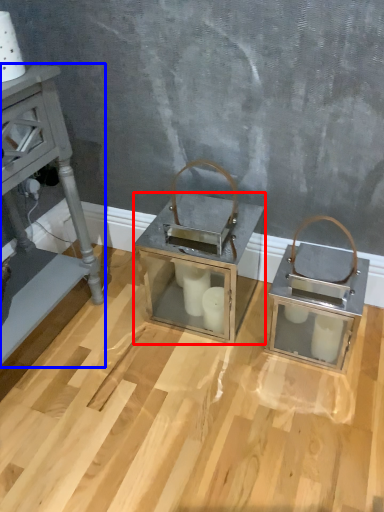
Question: Which of the following is the farthest to the observer, table (highlighted by a red box) or furniture (highlighted by a blue box)?

Choices:
 (A) table
 (B) furniture

Answer: (A)